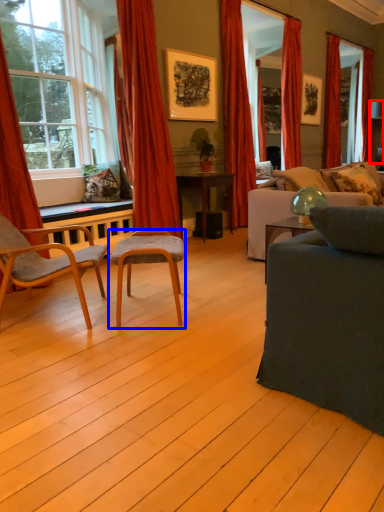
Question: Among these objects, which one is farthest to the camera, lamp (highlighted by a red box) or chair (highlighted by a blue box)?

Choices:
 (A) lamp
 (B) chair

Answer: (A)